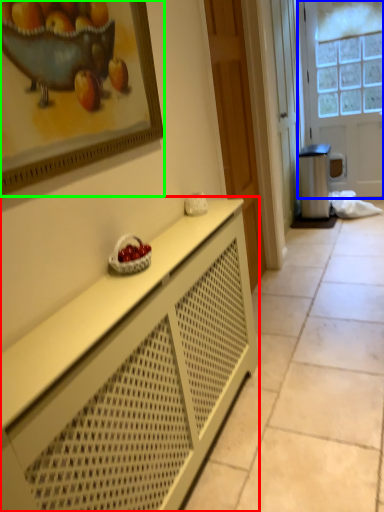
Question: Which object is positioned closest to cabinetry (highlighted by a red box)? Select from door (highlighted by a blue box) and picture frame (highlighted by a green box).

Choices:
 (A) door
 (B) picture frame

Answer: (B)